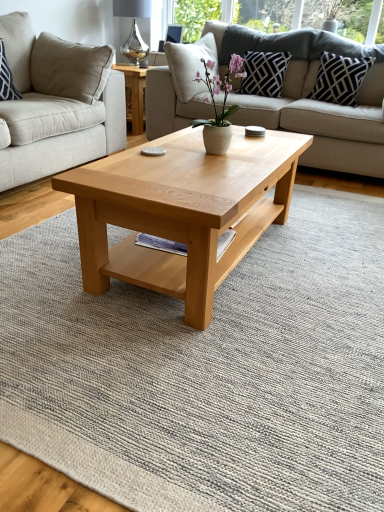
Question: Should I look upward or downward to see white matte vase at center?

Choices:
 (A) down
 (B) up

Answer: (B)

Question: Is blue and white striped pillow at upper left, acting as the first pillow starting from the left, at the right side of white matte vase at center?

Choices:
 (A) no
 (B) yes

Answer: (A)

Question: From a real-world perspective, is blue and white striped pillow at upper left, acting as the first pillow starting from the left, located beneath white matte vase at center?

Choices:
 (A) yes
 (B) no

Answer: (B)

Question: Considering the relative positions of blue and white striped pillow at upper left, which is the 3th pillow in right-to-left order, and white matte vase at center in the image provided, is blue and white striped pillow at upper left, which is the 3th pillow in right-to-left order, to the left of white matte vase at center from the viewer's perspective?

Choices:
 (A) no
 (B) yes

Answer: (B)

Question: Considering the relative sizes of blue and white striped pillow at upper left, acting as the first pillow starting from the left, and white matte vase at center in the image provided, is blue and white striped pillow at upper left, acting as the first pillow starting from the left, taller than white matte vase at center?

Choices:
 (A) yes
 (B) no

Answer: (A)

Question: Is blue and white striped pillow at upper left, acting as the first pillow starting from the left, smaller than white matte vase at center?

Choices:
 (A) no
 (B) yes

Answer: (A)

Question: Is blue and white striped pillow at upper left, acting as the first pillow starting from the left, turned away from white matte vase at center?

Choices:
 (A) no
 (B) yes

Answer: (A)

Question: Is natural wood coffee table at center thinner than blue and white striped pillow at upper left, acting as the first pillow starting from the left?

Choices:
 (A) yes
 (B) no

Answer: (B)

Question: Is natural wood coffee table at center closer to camera compared to blue and white striped pillow at upper left, acting as the first pillow starting from the left?

Choices:
 (A) yes
 (B) no

Answer: (A)

Question: Does natural wood coffee table at center appear on the right side of blue and white striped pillow at upper left, acting as the first pillow starting from the left?

Choices:
 (A) yes
 (B) no

Answer: (A)

Question: Is natural wood coffee table at center in contact with blue and white striped pillow at upper left, acting as the first pillow starting from the left?

Choices:
 (A) yes
 (B) no

Answer: (B)

Question: Would you say blue and white striped pillow at upper left, acting as the first pillow starting from the left, is part of natural wood coffee table at center's contents?

Choices:
 (A) yes
 (B) no

Answer: (B)

Question: Is natural wood coffee table at center turned away from blue and white striped pillow at upper left, which is the 3th pillow in right-to-left order?

Choices:
 (A) yes
 (B) no

Answer: (A)

Question: From a real-world perspective, is beige fabric studio couch at center, acting as the first studio couch starting from the left, beneath light beige fabric couch at center, placed as the second studio couch when sorted from left to right?

Choices:
 (A) no
 (B) yes

Answer: (B)